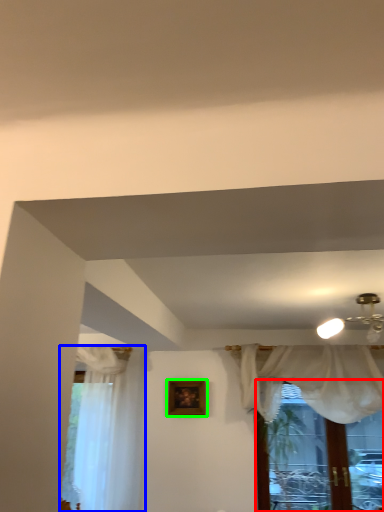
Question: Which object is positioned farthest from window (highlighted by a red box)? Select from curtain (highlighted by a blue box) and picture frame (highlighted by a green box).

Choices:
 (A) curtain
 (B) picture frame

Answer: (A)